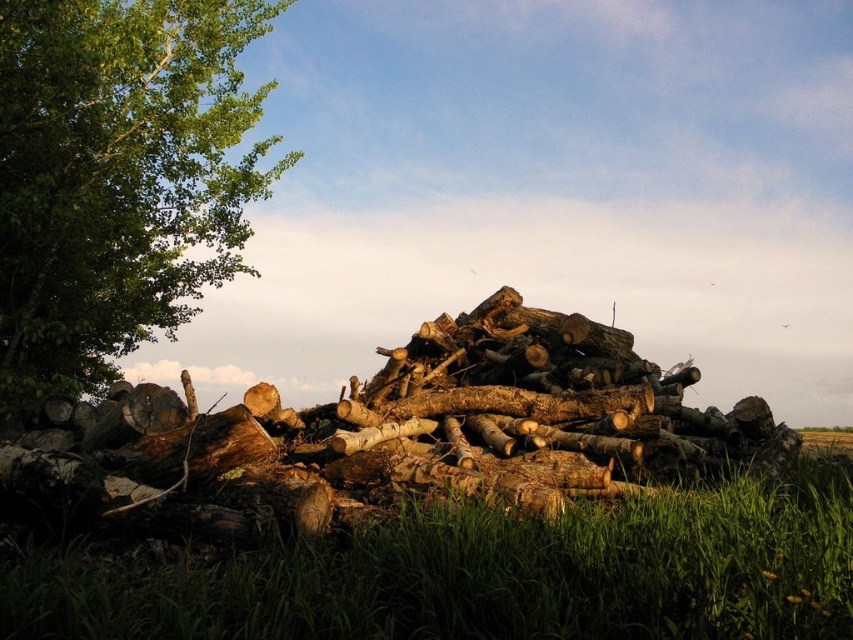
Looking at this image, who is more distant from viewer, (538, 627) or (6, 68)?

Positioned behind is point (6, 68).

Who is taller, green grass at lower center or green leafy tree at left?

green leafy tree at left is taller.

At what (x,y) coordinates should I click in order to perform the action: click on green grass at lower center. Please return your answer as a coordinate pair (x, y). Looking at the image, I should click on (485, 576).